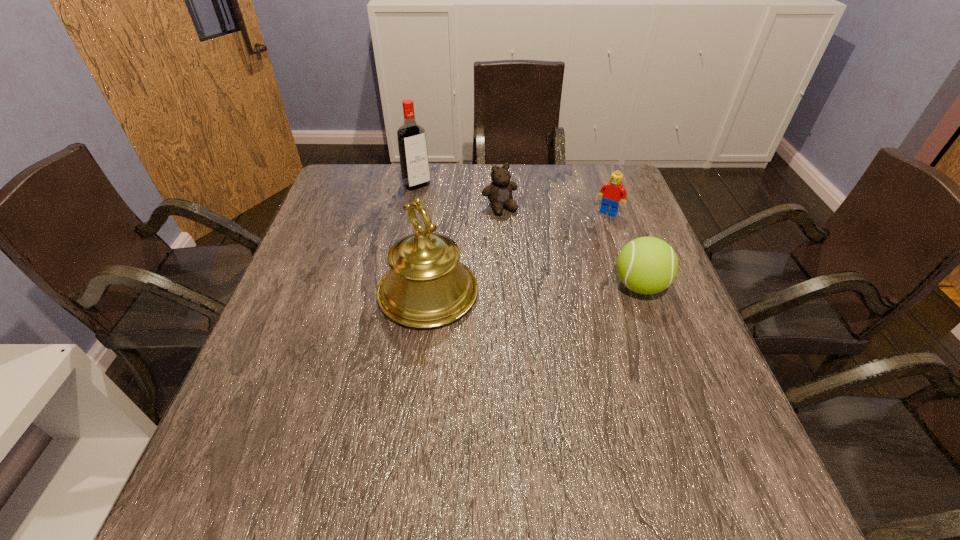
The width and height of the screenshot is (960, 540). I want to click on Lego at the right edge, so click(612, 192).

What are the coordinates of `object located in the far right corner section of the desktop` in the screenshot? It's located at (612, 192).

In the image, there is a desktop. Identify the location of vacant area at the far edge. (535, 197).

The width and height of the screenshot is (960, 540). Find the location of `free point at the near edge`. free point at the near edge is located at coordinates (447, 446).

This screenshot has height=540, width=960. In the image, there is a desktop. Identify the location of vacant region at the left edge. (237, 392).

Where is `vacant space at the right edge`? This screenshot has width=960, height=540. vacant space at the right edge is located at coordinates (636, 383).

Image resolution: width=960 pixels, height=540 pixels. In the image, there is a desktop. Find the location of `vacant space at the far left corner`. vacant space at the far left corner is located at coordinates (354, 185).

You are a GUI agent. You are given a task and a screenshot of the screen. Output one action in this format:
    pyautogui.click(x=<x>, y=<y>)
    Task: Click on the vacant space at the far right corner
    Image resolution: width=960 pixels, height=540 pixels.
    Given the screenshot: What is the action you would take?
    pyautogui.click(x=592, y=207)

The width and height of the screenshot is (960, 540). Find the location of `unoccupied position between the tennis ball and the bell`. unoccupied position between the tennis ball and the bell is located at coordinates (534, 289).

What are the coordinates of `vacant region between the bell and the Lego` in the screenshot? It's located at (518, 253).